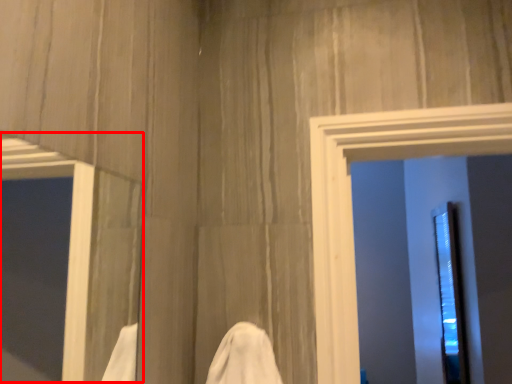
Question: Observing the image, what is the correct spatial positioning of window (annotated by the red box) in reference to screen door?

Choices:
 (A) left
 (B) right

Answer: (A)